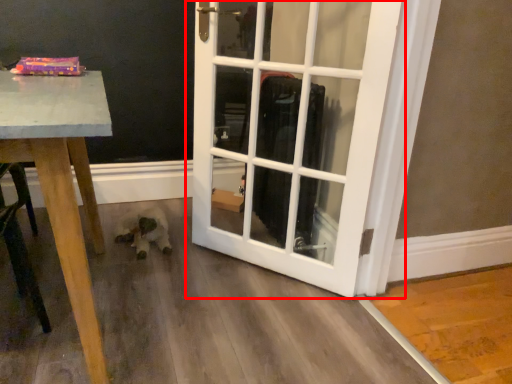
Question: From the image's perspective, where is door (annotated by the red box) located relative to animal?

Choices:
 (A) above
 (B) below

Answer: (A)